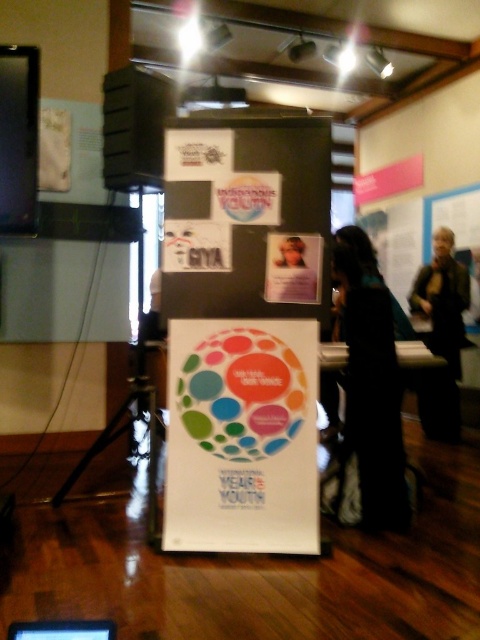
Question: Which object is farther from the camera taking this photo?

Choices:
 (A) matte plastic photo frame at center
 (B) black plastic computer at lower left
 (C) black glossy phone at upper left
 (D) dark brown leather jacket at right

Answer: (D)

Question: Is black fabric at center further to the viewer compared to black plastic computer at lower left?

Choices:
 (A) yes
 (B) no

Answer: (A)

Question: Is matte plastic photo frame at center above black plastic computer at lower left?

Choices:
 (A) no
 (B) yes

Answer: (B)

Question: Is black fabric at center positioned behind white paper at upper left?

Choices:
 (A) yes
 (B) no

Answer: (B)

Question: Estimate the real-world distances between objects in this image. Which object is farther from the white glossy table at center?

Choices:
 (A) white paper at upper left
 (B) dark brown leather jacket at right
 (C) black plastic computer at lower left
 (D) multicolored glossy poster at center

Answer: (A)

Question: Which object is farther from the camera taking this photo?

Choices:
 (A) black glossy phone at upper left
 (B) black plastic computer at lower left

Answer: (A)